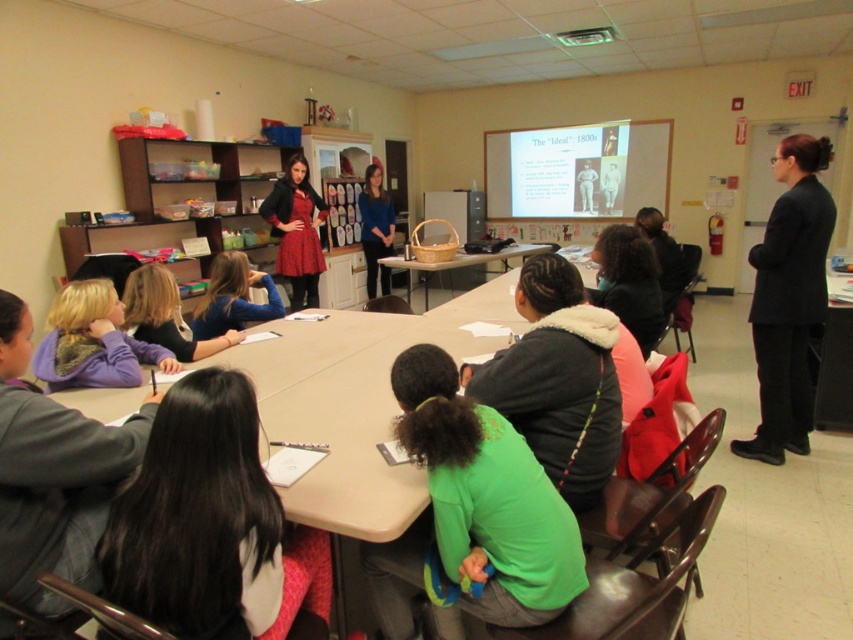
Who is higher up, matte white slide at upper center or wooden table at center?

matte white slide at upper center is higher up.

Is matte white slide at upper center wider than wooden table at center?

Yes.

Identify the location of matte white slide at upper center. (577, 170).

Does green fabric backpack at center have a greater height compared to wooden table at center?

Yes.

Does point (432, 496) come farther from viewer compared to point (403, 256)?

No, (432, 496) is in front of (403, 256).

Between point (532, 522) and point (511, 252), which one is positioned behind?

Point (511, 252)

At what (x,y) coordinates should I click in order to perform the action: click on green fabric backpack at center. Please return your answer as a coordinate pair (x, y). Looking at the image, I should click on (486, 497).

This screenshot has height=640, width=853. Describe the element at coordinates (788, 298) in the screenshot. I see `black matte suit at right` at that location.

Is black matte suit at right smaller than wooden table at center?

Yes, black matte suit at right is smaller than wooden table at center.

Locate an element on the screen. black matte suit at right is located at coordinates (788, 298).

Locate an element on the screen. The image size is (853, 640). black matte suit at right is located at coordinates (788, 298).